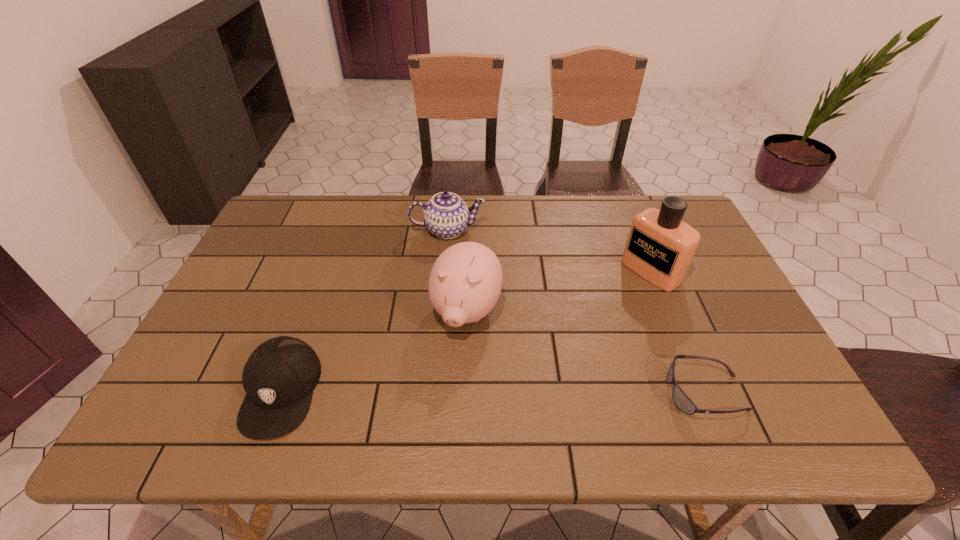
Where is `cap`? This screenshot has height=540, width=960. cap is located at coordinates (279, 377).

Find the location of a particular element. The image size is (960, 540). the leftmost object is located at coordinates (279, 377).

Locate an element on the screen. The height and width of the screenshot is (540, 960). sunglasses is located at coordinates (681, 400).

Image resolution: width=960 pixels, height=540 pixels. Identify the location of chinaware. (446, 215).

Locate an element on the screen. the farthest object is located at coordinates (446, 215).

This screenshot has width=960, height=540. I want to click on piggy bank, so pos(465,282).

Find the location of a particular element. the tallest object is located at coordinates (660, 247).

Locate an element on the screen. The width and height of the screenshot is (960, 540). free region located 0.160m on the lenses of the sunglasses is located at coordinates (596, 392).

Identify the location of vacant space located on the lenses of the sunglasses. The image size is (960, 540). (541, 392).

Where is `vacant space located 0.320m on the lenses of the sunglasses`? This screenshot has width=960, height=540. vacant space located 0.320m on the lenses of the sunglasses is located at coordinates (524, 392).